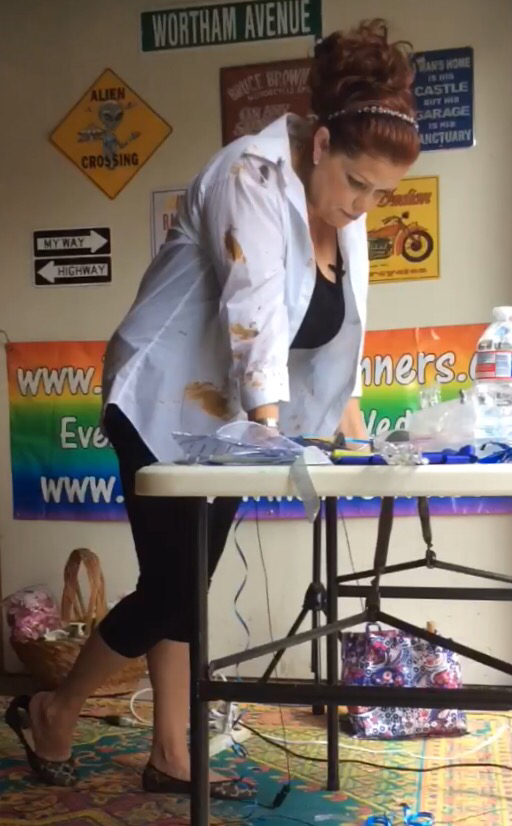
Identify the location of table legs. Image resolution: width=512 pixels, height=826 pixels. (201, 686), (327, 613), (332, 523).